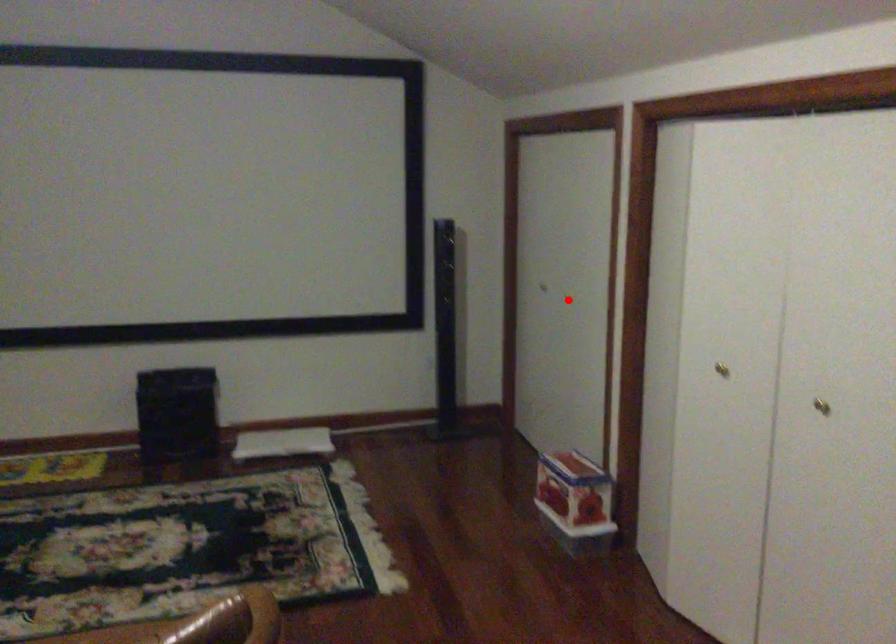
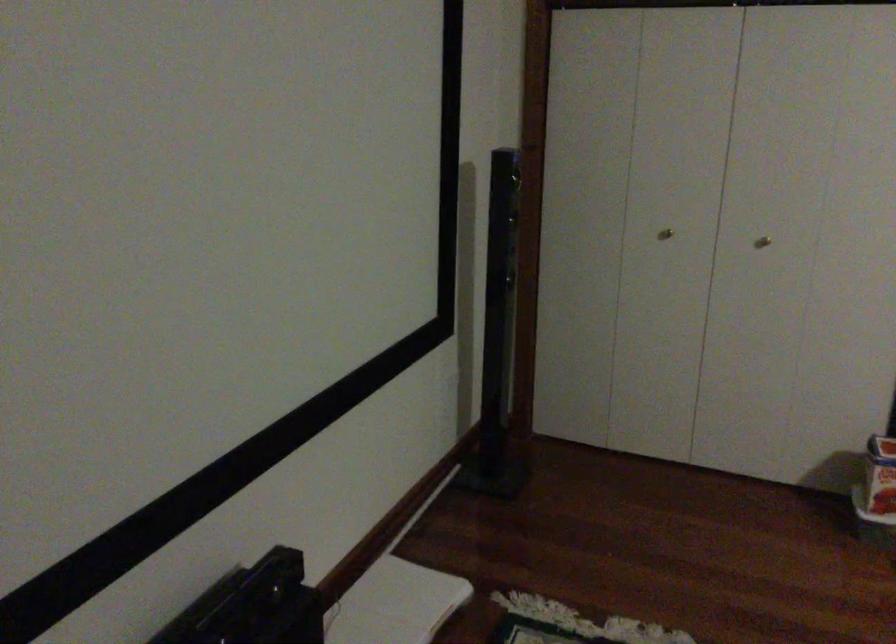
Question: I am providing you with two images of the same scene from different viewpoints. A red point is shown in image1. For the corresponding object point in image2, is it positioned nearer or farther from the camera?

Choices:
 (A) Nearer
 (B) Farther

Answer: (A)